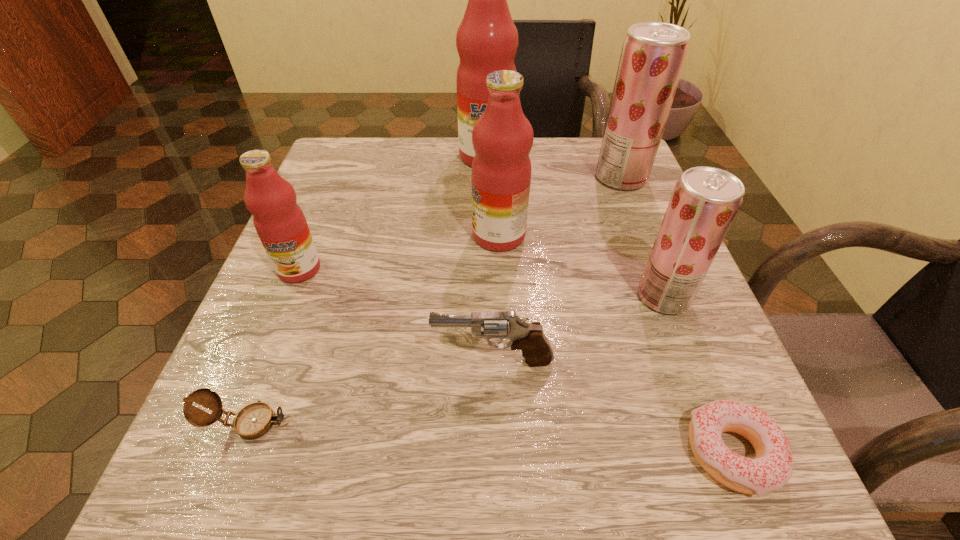
I want to click on the second shortest object, so click(254, 420).

Identify the location of doughnut. (772, 467).

At what (x,y) coordinates should I click in order to perform the action: click on the shortest object. Please return your answer as a coordinate pair (x, y). This screenshot has width=960, height=540. Looking at the image, I should click on (772, 467).

I want to click on blank area located 0.330m on the label of the farthest pink fruit juice, so click(488, 277).

This screenshot has width=960, height=540. What are the coordinates of `blank area located 0.050m on the left of the bigger strawberry fruit juice` in the screenshot? It's located at (573, 178).

The height and width of the screenshot is (540, 960). What are the coordinates of `vacant space located on the label of the second nearest pink fruit juice` in the screenshot? It's located at (368, 236).

Find the location of a particular element. This screenshot has width=960, height=540. vacant space situated 0.330m on the label of the second nearest pink fruit juice is located at coordinates (299, 236).

Locate an element on the screen. Image resolution: width=960 pixels, height=540 pixels. blank space located 0.300m on the label of the second nearest pink fruit juice is located at coordinates (315, 236).

This screenshot has height=540, width=960. Find the location of `free region located 0.080m on the back of the nearer strawberry fruit juice`. free region located 0.080m on the back of the nearer strawberry fruit juice is located at coordinates (644, 247).

At what (x,y) coordinates should I click in order to perform the action: click on free space located 0.310m on the label of the leftmost pink fruit juice. Please return your answer as a coordinate pair (x, y). Looking at the image, I should click on (218, 471).